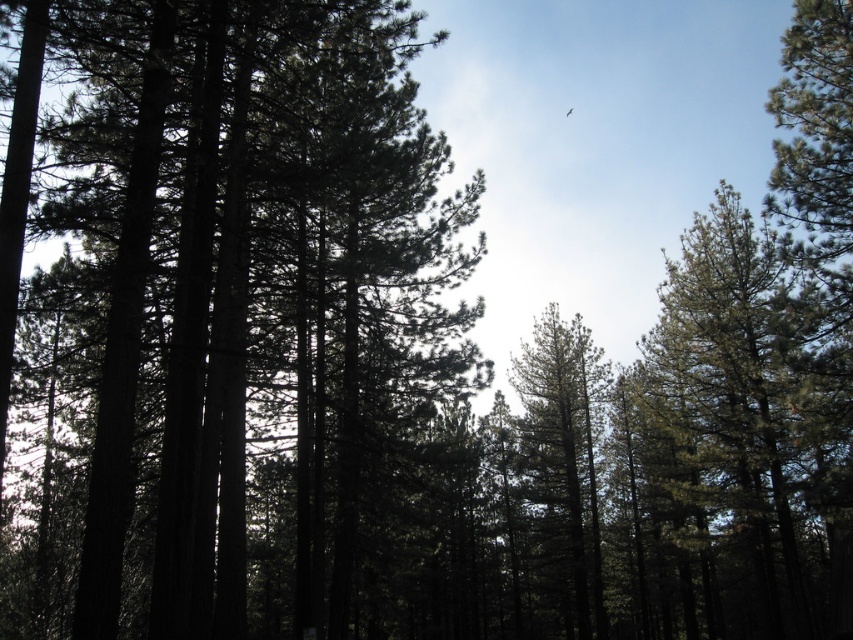
Does dark green pine trees at center appear on the left side of green matte tree at center?

Yes, dark green pine trees at center is to the left of green matte tree at center.

Which of these two, dark green pine trees at center or green matte tree at center, stands taller?

Standing taller between the two is dark green pine trees at center.

Is point (68, 268) closer to camera compared to point (596, 371)?

Yes, point (68, 268) is closer to viewer.

The height and width of the screenshot is (640, 853). In order to click on dark green pine trees at center in this screenshot , I will do `click(238, 275)`.